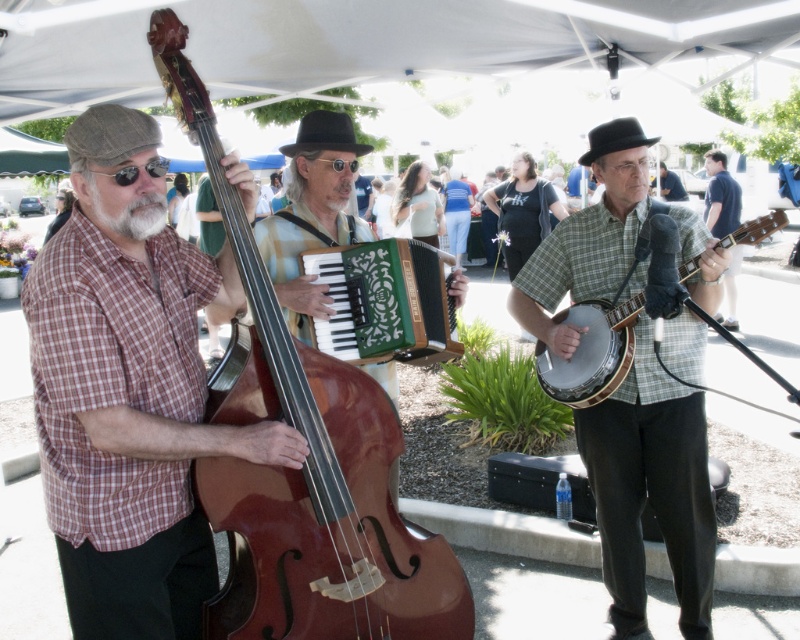
Question: Which point is closer to the camera taking this photo?

Choices:
 (A) (656, 372)
 (B) (186, 438)
 (C) (606, 330)

Answer: (B)

Question: Which is nearer to the green matte accordion at center?

Choices:
 (A) light brown leather jacket at center
 (B) matte plaid shirt at left

Answer: (B)

Question: Is green textured accordion at center positioned behind dark blue shirt at right?

Choices:
 (A) no
 (B) yes

Answer: (A)

Question: Is green matte accordion at center above white matte beard at left?

Choices:
 (A) yes
 (B) no

Answer: (B)

Question: Does matte plaid shirt at left come in front of green matte accordion at center?

Choices:
 (A) yes
 (B) no

Answer: (A)

Question: Which point is closer to the camera taking this photo?

Choices:
 (A) (150, 193)
 (B) (390, 328)
 (C) (262, 390)
 (D) (660, 177)

Answer: (A)